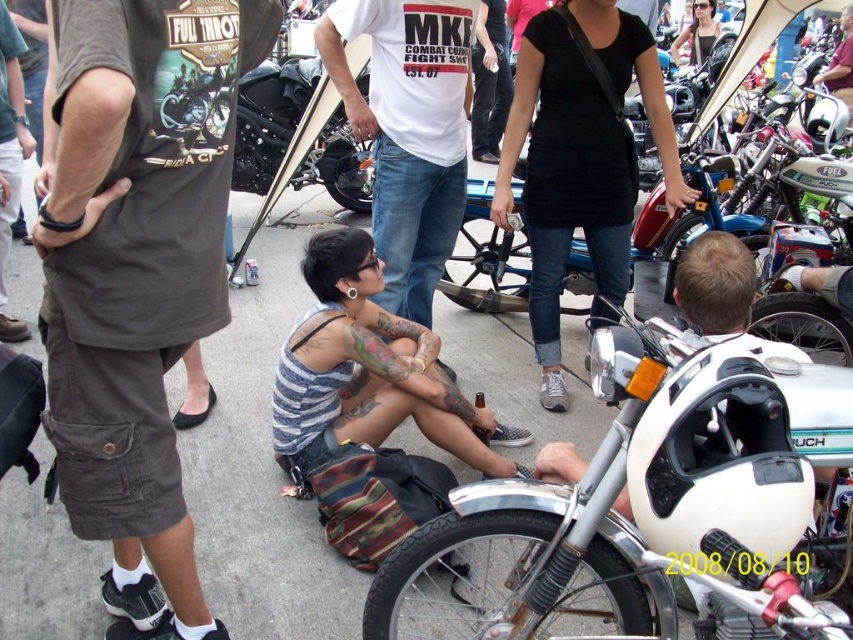
Is gray asphalt pavement at center further to the viewer compared to matte black tank top at center?

No, gray asphalt pavement at center is closer to the viewer.

Who is shorter, gray asphalt pavement at center or matte black tank top at center?

Standing shorter between the two is matte black tank top at center.

Between point (250, 298) and point (676, 36), which one is positioned behind?

The point (676, 36) is behind.

The width and height of the screenshot is (853, 640). I want to click on gray asphalt pavement at center, so click(x=263, y=460).

What do you see at coordinates (270, 118) in the screenshot? I see `shiny black motorcycle at center` at bounding box center [270, 118].

Is point (257, 83) farther from camera compared to point (712, 3)?

No, (257, 83) is in front of (712, 3).

What do you see at coordinates (270, 118) in the screenshot? I see `shiny black motorcycle at center` at bounding box center [270, 118].

This screenshot has width=853, height=640. Find the location of `shiny black motorcycle at center`. shiny black motorcycle at center is located at coordinates click(x=270, y=118).

Find the location of a particular element. This screenshot has height=640, width=853. gray asphalt pavement at center is located at coordinates (263, 460).

Who is more distant from viewer, (97,586) or (398,298)?

The point (398,298) is behind.

Find the location of a particular element. The image size is (853, 640). gray asphalt pavement at center is located at coordinates (263, 460).